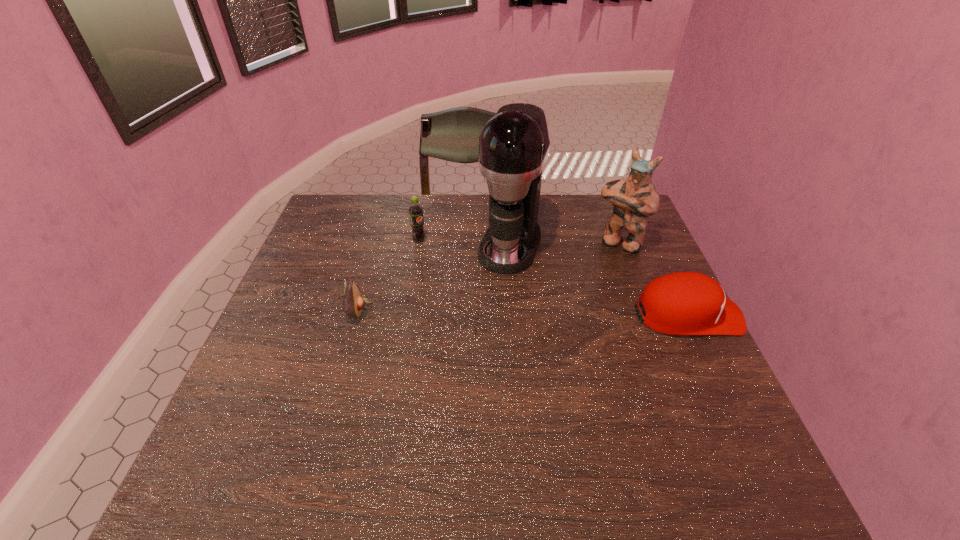
At what (x,y) coordinates should I click in order to perform the action: click on free spot on the desktop that is between the avocado and the baseball cap and is positioned on the front-facing side of the fourth shortest object. Please return your answer as a coordinate pair (x, y). This screenshot has height=540, width=960. Looking at the image, I should click on (569, 313).

Where is `vacant spot on the desktop that is between the leftmost object and the baseball cap and is positioned place cup under the spout of the third object from right to left`? The height and width of the screenshot is (540, 960). vacant spot on the desktop that is between the leftmost object and the baseball cap and is positioned place cup under the spout of the third object from right to left is located at coordinates (482, 312).

The image size is (960, 540). In order to click on vacant space on the desktop that is between the avocado and the baseball cap and is positioned on the front label of the fourth object from right to left in this screenshot , I will do `click(514, 312)`.